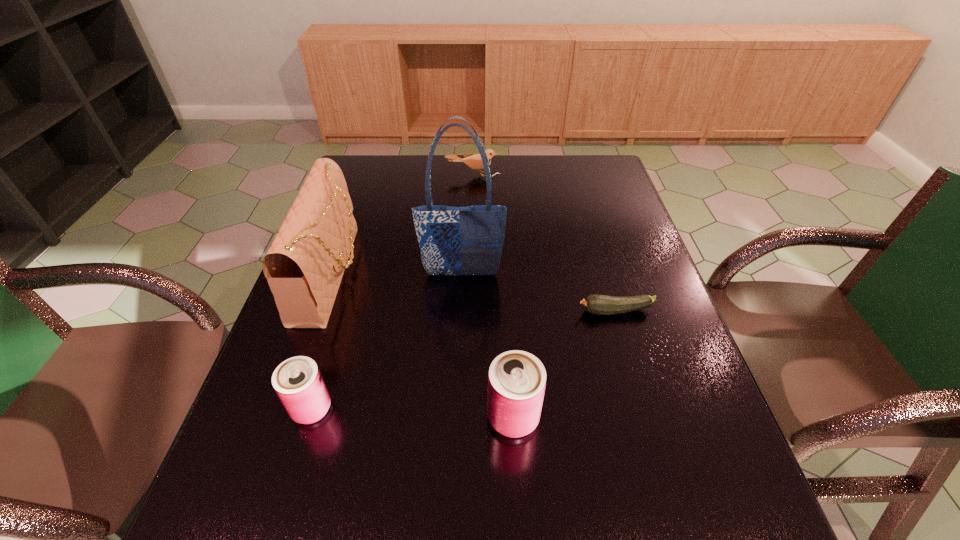
Find the location of `free point located 0.300m on the back of the left can`. free point located 0.300m on the back of the left can is located at coordinates (348, 286).

This screenshot has width=960, height=540. I want to click on vacant region located on the left of the right can, so click(327, 417).

Identify the location of free point located at the beak of the bird. This screenshot has height=540, width=960. (472, 195).

Identify the location of free spot located 0.110m at the blossom end of the rightmost object. (531, 312).

This screenshot has height=540, width=960. What are the coordinates of `vacant area situated at the blossom end of the rightmost object` in the screenshot? It's located at (459, 312).

At what (x,y) coordinates should I click in order to perform the action: click on vacant space located at the blossom end of the rightmost object. Please return your answer as a coordinate pair (x, y). This screenshot has height=540, width=960. Looking at the image, I should click on (526, 312).

Image resolution: width=960 pixels, height=540 pixels. Find the location of `vacant region located on the front-facing side of the shopping bag`. vacant region located on the front-facing side of the shopping bag is located at coordinates (456, 417).

The height and width of the screenshot is (540, 960). I want to click on vacant space located 0.170m on the front-facing side of the handbag, so click(423, 274).

At what (x,y) coordinates should I click in order to perform the action: click on object at the far edge. Please return your answer as a coordinate pair (x, y). The width and height of the screenshot is (960, 540). Looking at the image, I should click on (474, 161).

What are the coordinates of `can that is at the left edge` in the screenshot? It's located at (298, 382).